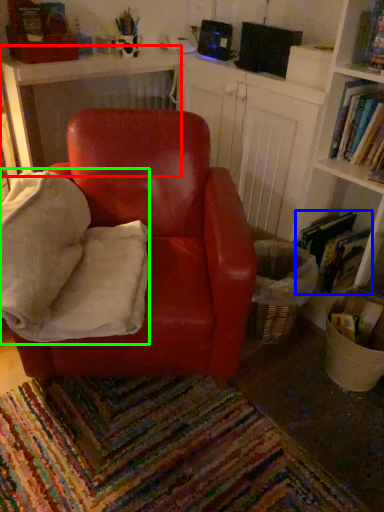
Question: Which object is the farthest from table (highlighted by a red box)? Choose among these: book (highlighted by a blue box) or bean bag chair (highlighted by a green box).

Choices:
 (A) book
 (B) bean bag chair

Answer: (A)